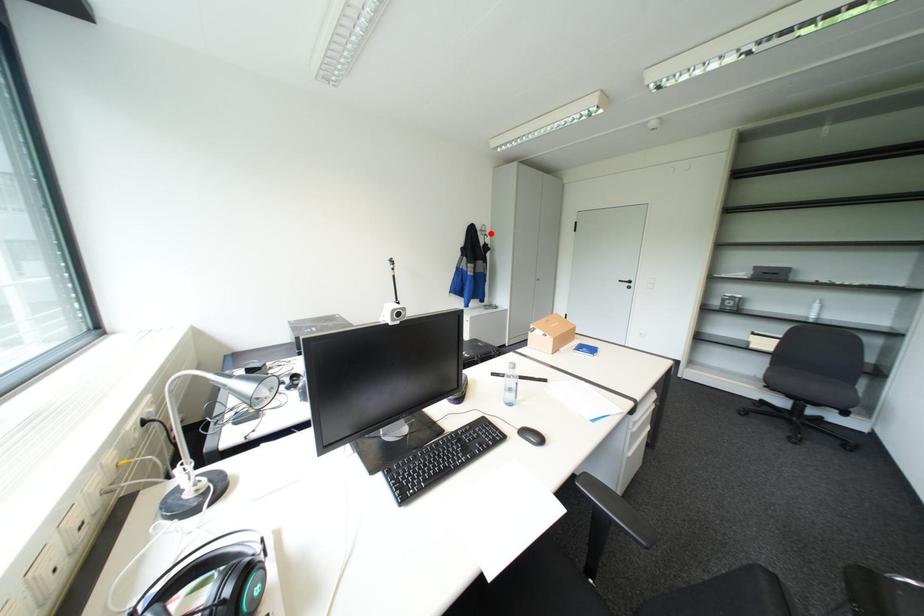
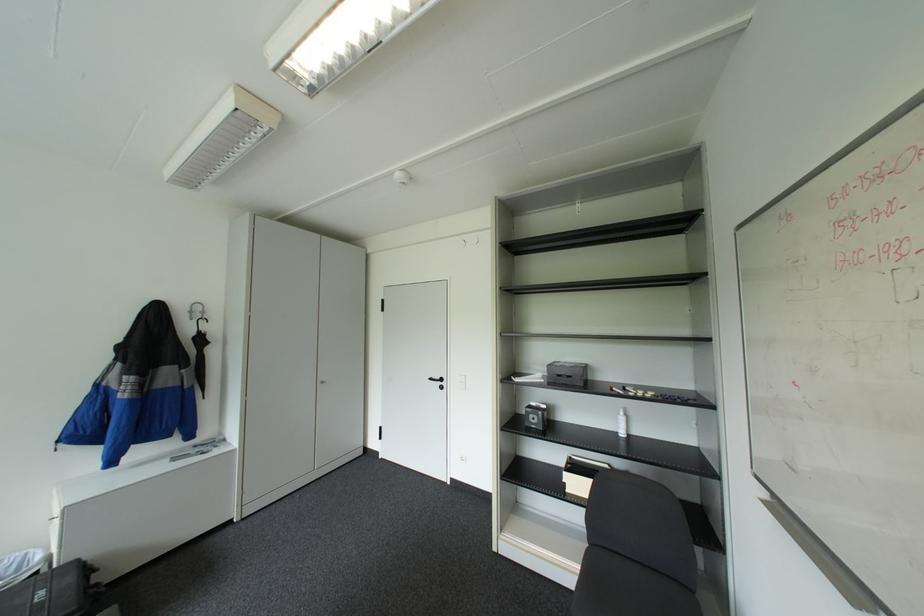
Locate, in the second image, the point that corresponds to the highlighted location in the first image.

(200, 318)